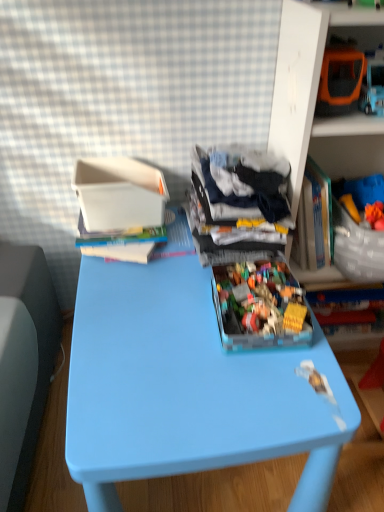
Question: Visually, is blue plastic table at center positioned to the left or to the right of dark blue fabric at center?

Choices:
 (A) left
 (B) right

Answer: (A)

Question: Is blue plastic table at center wider or thinner than dark blue fabric at center?

Choices:
 (A) wide
 (B) thin

Answer: (A)

Question: Estimate the real-world distances between objects in this image. Which object is closer to the blue plastic table at center?

Choices:
 (A) translucent plastic container at center
 (B) white plastic container at upper left
 (C) orange plastic toy car at upper right, the 2th shelf from the right
 (D) translucent plastic container at upper right, arranged as the 1th shelf when viewed from the right
 (E) dark blue fabric at center

Answer: (A)

Question: Which object is the farthest from the blue plastic table at center?

Choices:
 (A) translucent plastic container at upper right, arranged as the 1th shelf when viewed from the right
 (B) dark blue fabric at center
 (C) orange plastic toy car at upper right, the 2th shelf from the right
 (D) white plastic container at upper left
 (E) translucent plastic container at center

Answer: (C)